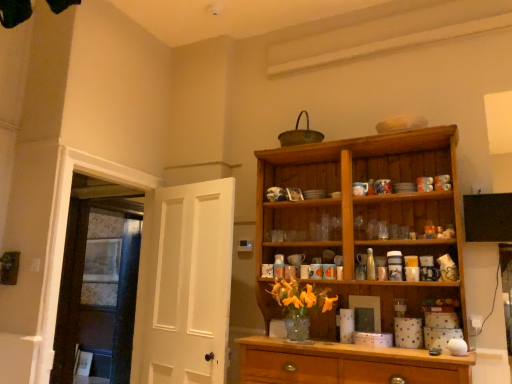
Describe the element at coordinates (98, 289) in the screenshot. This screenshot has width=512, height=384. I see `white wooden door at left, which appears as the 2th door when viewed from the front` at that location.

Identify the location of white wooden door at left, which is counted as the 1th door, starting from the back. coord(98,289).

The image size is (512, 384). What do you see at coordinates (362, 214) in the screenshot?
I see `wooden cabinet at right` at bounding box center [362, 214].

Identify the location of white wooden door at left, which appears as the 2th door when viewed from the front. (98, 289).

Which of these two, wooden cabinet at right or white matte door at left, the first door when ordered from front to back, is wider?

With larger width is wooden cabinet at right.

Is wooden cabinet at right next to white matte door at left, the first door when ordered from front to back?

No, wooden cabinet at right is not next to white matte door at left, the first door when ordered from front to back.

Does point (332, 220) come in front of point (156, 265)?

Yes, point (332, 220) is in front of point (156, 265).

From the image's perspective, is wooden cabinet at right on top of white matte door at left, marked as the 2th door in a left-to-right arrangement?

Yes, from the image's perspective, wooden cabinet at right is on top of white matte door at left, marked as the 2th door in a left-to-right arrangement.

How different are the orientations of white wooden door at left, which appears as the 2th door when viewed from the front, and white matte door at left, marked as the second door in a back-to-front arrangement, in degrees?

11.6 degrees separate the facing orientations of white wooden door at left, which appears as the 2th door when viewed from the front, and white matte door at left, marked as the second door in a back-to-front arrangement.

From a real-world perspective, which is physically below, white wooden door at left, marked as the second door in a right-to-left arrangement, or white matte door at left, the first door when ordered from front to back?

white wooden door at left, marked as the second door in a right-to-left arrangement, from a real-world perspective.

Does point (110, 251) come in front of point (167, 298)?

No, it is not.

In terms of width, does white wooden door at left, which appears as the 2th door when viewed from the front, look wider or thinner when compared to white matte door at left, the first door in the right-to-left sequence?

white wooden door at left, which appears as the 2th door when viewed from the front, is wider than white matte door at left, the first door in the right-to-left sequence.

Find the location of a particular element. This screenshot has width=512, height=384. cupboard that appears above the white matte door at left, the first door in the right-to-left sequence (from a real-world perspective) is located at coordinates (362, 214).

Considering the relative sizes of white matte door at left, the first door in the right-to-left sequence, and wooden cabinet at right in the image provided, is white matte door at left, the first door in the right-to-left sequence, shorter than wooden cabinet at right?

Correct, white matte door at left, the first door in the right-to-left sequence, is not as tall as wooden cabinet at right.

From the image's perspective, which is below, white matte door at left, marked as the second door in a back-to-front arrangement, or wooden cabinet at right?

From the image's view, white matte door at left, marked as the second door in a back-to-front arrangement, is below.

Is there a large distance between wooden cabinet at right and white wooden door at left, which is counted as the 1th door, starting from the back?

That's right, there is a large distance between wooden cabinet at right and white wooden door at left, which is counted as the 1th door, starting from the back.

From a real-world perspective, which object rests below the other?

white wooden door at left, which is counted as the 1th door, starting from the back.

Is wooden cabinet at right facing away from white wooden door at left, acting as the first door starting from the left?

No, wooden cabinet at right is not facing away from white wooden door at left, acting as the first door starting from the left.

Considering the relative sizes of wooden cabinet at right and white wooden door at left, acting as the first door starting from the left, in the image provided, is wooden cabinet at right thinner than white wooden door at left, acting as the first door starting from the left,?

No.

Which of these two, white wooden door at left, marked as the second door in a right-to-left arrangement, or wooden cabinet at right, stands taller?

white wooden door at left, marked as the second door in a right-to-left arrangement.

Which object is positioned more to the right, white wooden door at left, which is counted as the 1th door, starting from the back, or wooden cabinet at right?

From the viewer's perspective, wooden cabinet at right appears more on the right side.

Between point (61, 367) and point (397, 199), which one is positioned in front?

The point (397, 199) is more forward.

Would you consider white wooden door at left, which appears as the 2th door when viewed from the front, to be distant from wooden cabinet at right?

Yes.

Image resolution: width=512 pixels, height=384 pixels. I want to click on door above the white wooden door at left, which appears as the 2th door when viewed from the front (from the image's perspective), so click(184, 284).

Based on their sizes in the image, would you say white matte door at left, the first door when ordered from front to back, is bigger or smaller than white wooden door at left, acting as the first door starting from the left?

Considering their sizes, white matte door at left, the first door when ordered from front to back, takes up less space than white wooden door at left, acting as the first door starting from the left.

Can we say white matte door at left, marked as the 2th door in a left-to-right arrangement, lies outside white wooden door at left, which appears as the 2th door when viewed from the front?

Absolutely, white matte door at left, marked as the 2th door in a left-to-right arrangement, is external to white wooden door at left, which appears as the 2th door when viewed from the front.

The height and width of the screenshot is (384, 512). I want to click on cupboard in front of the white matte door at left, marked as the 2th door in a left-to-right arrangement, so click(362, 214).

Find the location of a particular element. The width and height of the screenshot is (512, 384). door above the white wooden door at left, acting as the first door starting from the left (from a real-world perspective) is located at coordinates (184, 284).

Which object lies further to the anchor point wooden cabinet at right, white wooden door at left, marked as the second door in a right-to-left arrangement, or white matte door at left, the first door when ordered from front to back?

The object further to wooden cabinet at right is white wooden door at left, marked as the second door in a right-to-left arrangement.

Based on their spatial positions, is white wooden door at left, marked as the second door in a right-to-left arrangement, or wooden cabinet at right closer to white matte door at left, marked as the second door in a back-to-front arrangement?

Among the two, white wooden door at left, marked as the second door in a right-to-left arrangement, is located nearer to white matte door at left, marked as the second door in a back-to-front arrangement.

When comparing their distances from white wooden door at left, which is counted as the 1th door, starting from the back, does white matte door at left, the first door when ordered from front to back, or wooden cabinet at right seem further?

wooden cabinet at right is further to white wooden door at left, which is counted as the 1th door, starting from the back.

Which object lies further to the anchor point white matte door at left, the first door in the right-to-left sequence, wooden cabinet at right or white wooden door at left, marked as the second door in a right-to-left arrangement?

wooden cabinet at right.

Which object lies further to the anchor point white wooden door at left, which is counted as the 1th door, starting from the back, wooden cabinet at right or white matte door at left, marked as the second door in a back-to-front arrangement?

wooden cabinet at right is positioned further to the anchor white wooden door at left, which is counted as the 1th door, starting from the back.

Estimate the real-world distances between objects in this image. Which object is further from wooden cabinet at right, white matte door at left, marked as the 2th door in a left-to-right arrangement, or white wooden door at left, which is counted as the 1th door, starting from the back?

white wooden door at left, which is counted as the 1th door, starting from the back, is further to wooden cabinet at right.

The width and height of the screenshot is (512, 384). In order to click on door located between white wooden door at left, which appears as the 2th door when viewed from the front, and wooden cabinet at right in the left-right direction in this screenshot , I will do `click(184, 284)`.